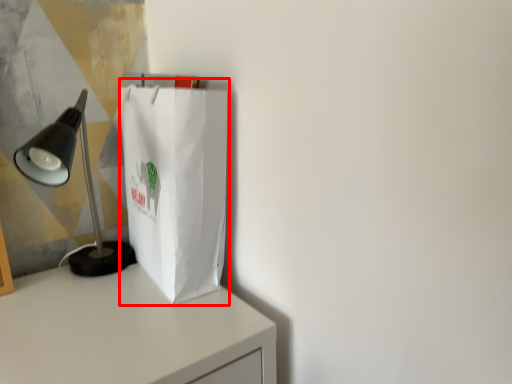
Question: From the image's perspective, where is grocery bag (annotated by the red box) located in relation to lamp in the image?

Choices:
 (A) below
 (B) above

Answer: (B)